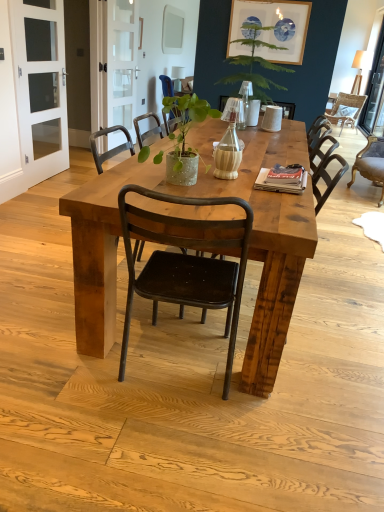
Question: Can you confirm if white matte picture frame at upper center is taller than white glass screen door at left, the first screen door from the front?

Choices:
 (A) no
 (B) yes

Answer: (A)

Question: From the image's perspective, would you say white matte picture frame at upper center is shown under white glass screen door at left, the 2th screen door positioned from the right?

Choices:
 (A) yes
 (B) no

Answer: (B)

Question: Is white matte picture frame at upper center thinner than white glass screen door at left, the first screen door from the front?

Choices:
 (A) yes
 (B) no

Answer: (A)

Question: From the image's perspective, is white matte picture frame at upper center over white glass screen door at left, the 1th screen door in the left-to-right sequence?

Choices:
 (A) yes
 (B) no

Answer: (A)

Question: Considering the relative positions of white matte picture frame at upper center and white glass screen door at left, the 1th screen door in the left-to-right sequence, in the image provided, is white matte picture frame at upper center behind white glass screen door at left, the 1th screen door in the left-to-right sequence,?

Choices:
 (A) no
 (B) yes

Answer: (B)

Question: Relative to metallic black chair at center, which appears as the third chair when viewed from the front, is rustic wood chair at center, positioned as the third chair in right-to-left order, in front or behind?

Choices:
 (A) behind
 (B) front

Answer: (B)

Question: Considering the positions of rustic wood chair at center, the 1th chair from the bottom, and metallic black chair at center, the second chair when ordered from top to bottom, in the image, is rustic wood chair at center, the 1th chair from the bottom, bigger or smaller than metallic black chair at center, the second chair when ordered from top to bottom,?

Choices:
 (A) big
 (B) small

Answer: (B)

Question: From the image's perspective, is rustic wood chair at center, the 1th chair from the bottom, located above or below metallic black chair at center, which appears as the third chair when viewed from the front?

Choices:
 (A) below
 (B) above

Answer: (A)

Question: Is rustic wood chair at center, arranged as the second chair when viewed from the left, wider or thinner than metallic black chair at center, which appears as the third chair when viewed from the front?

Choices:
 (A) thin
 (B) wide

Answer: (A)

Question: Is point (271, 122) closer or farther from the camera than point (248, 71)?

Choices:
 (A) farther
 (B) closer

Answer: (B)

Question: Which is correct: matte beige cup at center is inside green leafy plant at upper center, arranged as the 1th houseplant when viewed from the right, or outside of it?

Choices:
 (A) outside
 (B) inside

Answer: (B)

Question: Is matte beige cup at center taller or shorter than green leafy plant at upper center, arranged as the 2th houseplant when ordered from the bottom?

Choices:
 (A) short
 (B) tall

Answer: (A)

Question: In terms of width, does matte beige cup at center look wider or thinner when compared to green leafy plant at upper center, the first houseplant when ordered from top to bottom?

Choices:
 (A) thin
 (B) wide

Answer: (A)

Question: Would you say white glass screen door at left, the 2th screen door positioned from the right, is inside or outside matte beige cup at center?

Choices:
 (A) inside
 (B) outside

Answer: (B)

Question: Considering their positions, is white glass screen door at left, the 2th screen door positioned from the right, located in front of or behind matte beige cup at center?

Choices:
 (A) behind
 (B) front

Answer: (B)